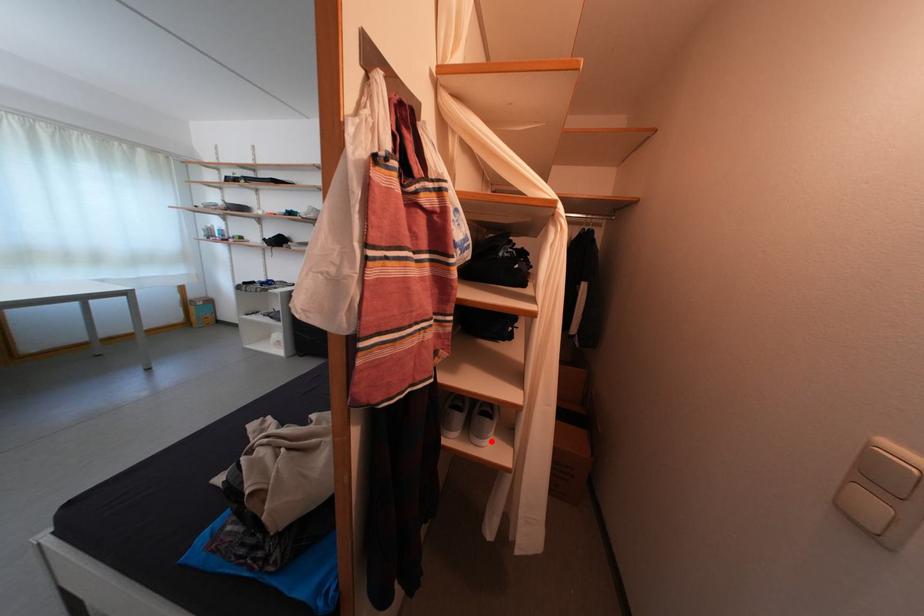
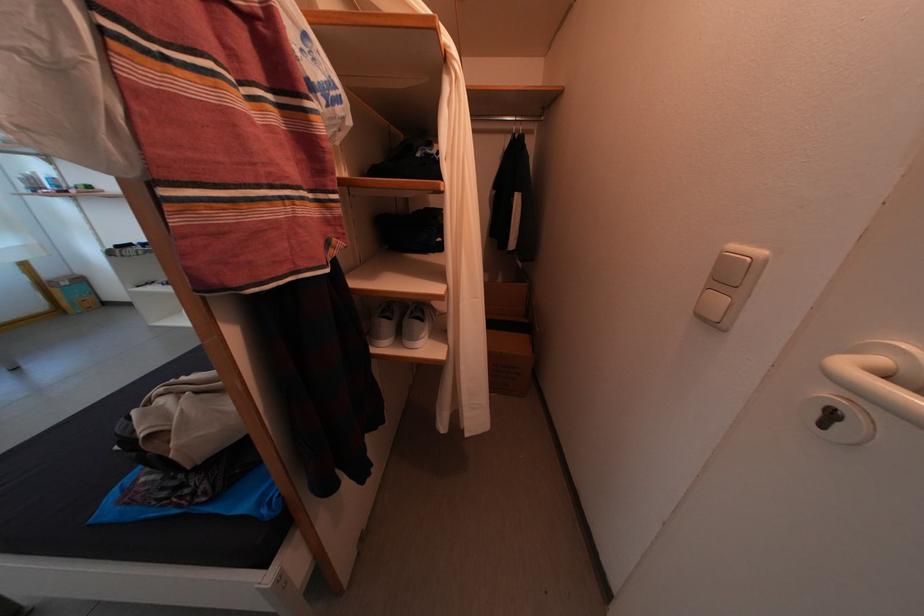
Find the pixel in the second image that matches the highlighted location in the first image.

(423, 344)